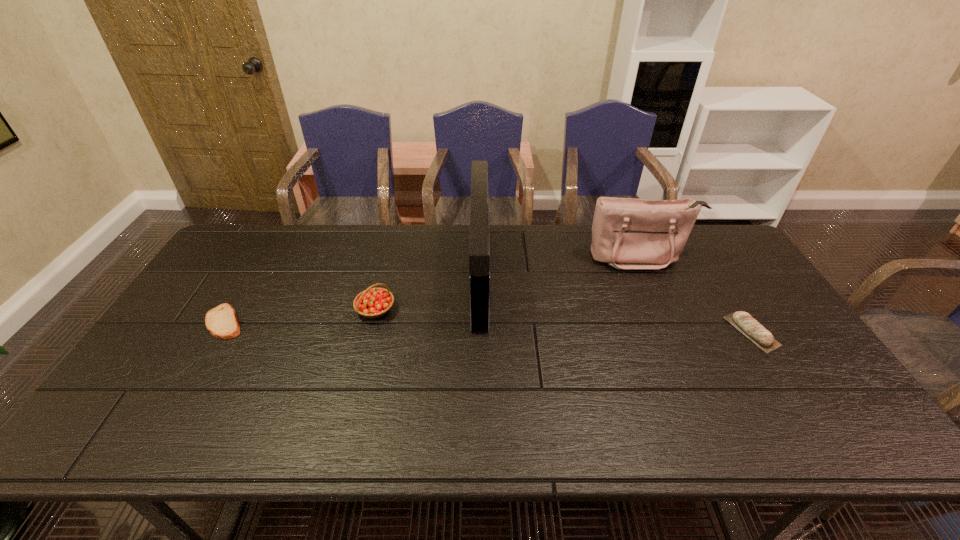
Where is `free space located on the front side of the videotape`? The height and width of the screenshot is (540, 960). free space located on the front side of the videotape is located at coordinates (444, 275).

Where is `vacant region located 0.050m on the front side of the videotape`? Image resolution: width=960 pixels, height=540 pixels. vacant region located 0.050m on the front side of the videotape is located at coordinates (456, 275).

Locate an element on the screen. free region located on the front pocket of the fourth shortest object is located at coordinates (655, 291).

Locate an element on the screen. vacant space located 0.240m on the back of the third shortest object is located at coordinates (391, 248).

This screenshot has height=540, width=960. Identify the location of vacant area situated 0.330m on the back of the right pita bread. (697, 243).

In order to click on vacant point located on the back of the left pita bread in this screenshot , I will do `click(265, 255)`.

Where is `videotape that is positioned at the far edge`? Image resolution: width=960 pixels, height=540 pixels. videotape that is positioned at the far edge is located at coordinates (479, 242).

The width and height of the screenshot is (960, 540). Identify the location of shoulder bag that is at the far edge. (627, 233).

The image size is (960, 540). Find the location of `object present at the left edge`. object present at the left edge is located at coordinates (222, 322).

Find the location of `shoulder bag that is at the right edge`. shoulder bag that is at the right edge is located at coordinates (627, 233).